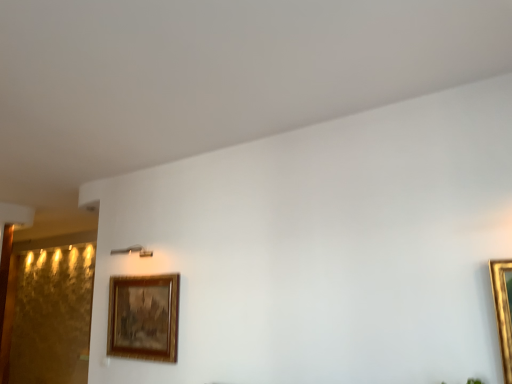
Where is `wooden gold picture frame at center-left`? Image resolution: width=512 pixels, height=384 pixels. wooden gold picture frame at center-left is located at coordinates (144, 317).

Image resolution: width=512 pixels, height=384 pixels. Describe the element at coordinates (144, 317) in the screenshot. I see `wooden gold picture frame at center-left` at that location.

This screenshot has height=384, width=512. Find the location of `wooden gold picture frame at center-left`. wooden gold picture frame at center-left is located at coordinates (144, 317).